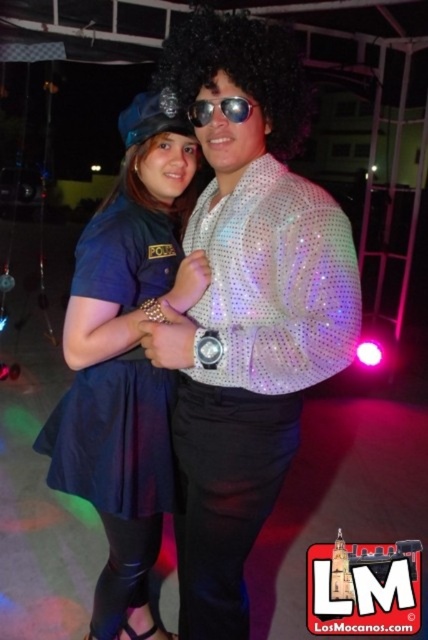
Question: Considering the relative positions of blue fabric skirt at center and sunglasses at center in the image provided, where is blue fabric skirt at center located with respect to sunglasses at center?

Choices:
 (A) above
 (B) below

Answer: (B)

Question: Considering the relative positions of shiny sequined shirt at center and sunglasses at center in the image provided, where is shiny sequined shirt at center located with respect to sunglasses at center?

Choices:
 (A) below
 (B) above

Answer: (A)

Question: Which of the following is the farthest from the observer?

Choices:
 (A) blue fabric skirt at center
 (B) shiny sequined shirt at center
 (C) sunglasses at center

Answer: (A)

Question: Is shiny sequined shirt at center above blue fabric skirt at center?

Choices:
 (A) no
 (B) yes

Answer: (B)

Question: Among these objects, which one is nearest to the camera?

Choices:
 (A) blue fabric skirt at center
 (B) shiny sequined shirt at center

Answer: (B)

Question: Which point is closer to the camera taking this photo?

Choices:
 (A) (272, 221)
 (B) (204, 104)
 (C) (171, 225)

Answer: (A)